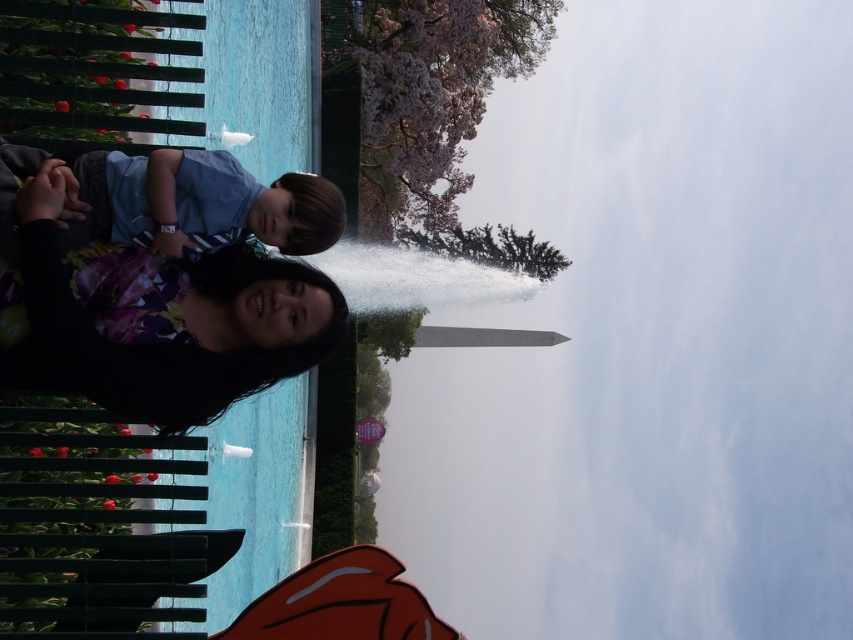
You are a photographer standing at the edge of the reflecting pool. You notice the black floral dress at lower left and the blue striped shirt at left in your viewfinder. Which clothing item appears bigger in the photo?

The black floral dress at lower left appears bigger in the photo because it has a larger size compared to the blue striped shirt at left.

You are standing at the edge of the reflecting pool and want to take a photo of the clear blue water at center and the black floral dress at lower left. Which object is higher in the frame?

The clear blue water at center is taller than the black floral dress at lower left, so it appears higher in the frame.

You are standing in the park and see the clear blue water at center and the blue striped shirt at left. Which object is closer to the ground?

The clear blue water at center is positioned under the blue striped shirt at left, so the clear blue water at center is closer to the ground.